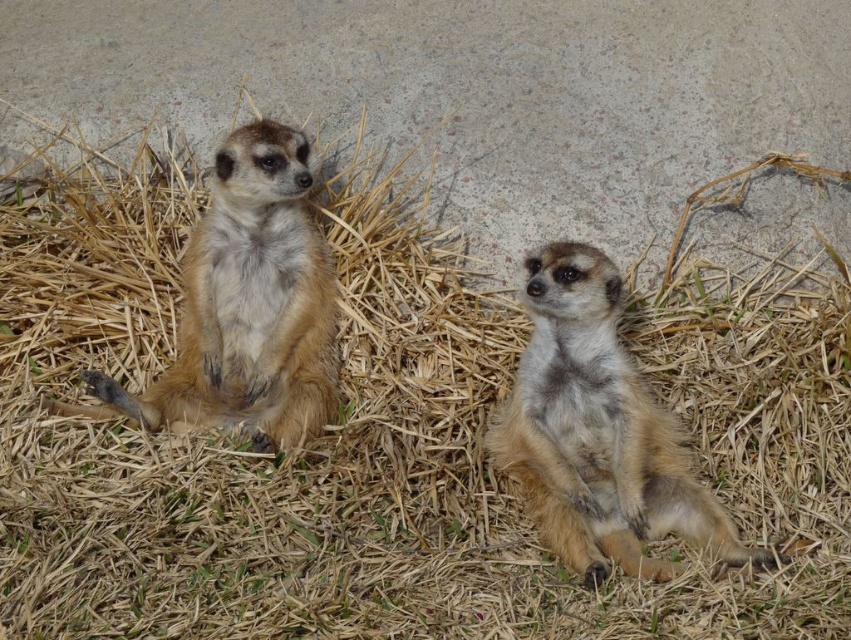
Is fuzzy brown meerkat at center smaller than golden fur meerkat at left?

Yes.

Is fuzzy brown meerkat at center above golden fur meerkat at left?

No.

Is point (572, 380) positioned before point (275, 154)?

Yes, it is in front of point (275, 154).

Find the location of a particular element. This screenshot has height=640, width=851. fuzzy brown meerkat at center is located at coordinates (598, 432).